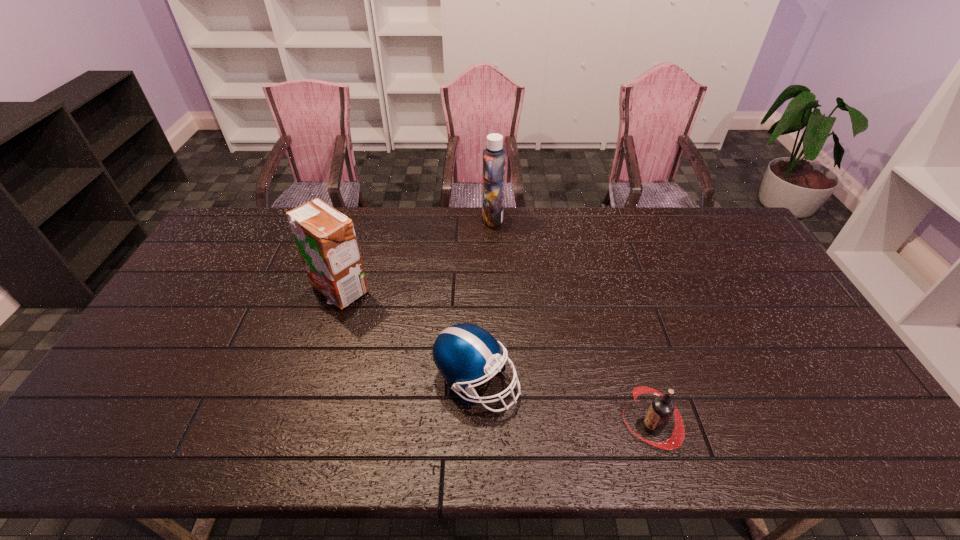
The height and width of the screenshot is (540, 960). Find the location of `free region at the near right corner`. free region at the near right corner is located at coordinates (862, 437).

Locate an element on the screen. This screenshot has width=960, height=540. vacant point located between the rightmost object and the football helmet is located at coordinates (564, 404).

Identify the location of free space between the root beer and the farthest object. (572, 322).

The width and height of the screenshot is (960, 540). I want to click on free area in between the farthest object and the rightmost object, so click(x=572, y=322).

This screenshot has width=960, height=540. In order to click on free space that is in between the farthest object and the root beer in this screenshot , I will do `click(572, 322)`.

I want to click on empty space that is in between the second farthest object and the football helmet, so click(x=408, y=336).

You are a GUI agent. You are given a task and a screenshot of the screen. Output one action in this format:
    pyautogui.click(x=<x>, y=<y>)
    Task: Click on the free space between the leftmost object and the football helmet
    The width and height of the screenshot is (960, 540).
    Given the screenshot: What is the action you would take?
    coord(408,336)

Find the location of a particular element. The width and height of the screenshot is (960, 540). free spot between the shampoo and the football helmet is located at coordinates (485, 300).

Where is `free area in between the root beer and the football helmet`? free area in between the root beer and the football helmet is located at coordinates (564, 404).

The height and width of the screenshot is (540, 960). Find the location of `free spot between the rightmost object and the football helmet`. free spot between the rightmost object and the football helmet is located at coordinates (564, 404).